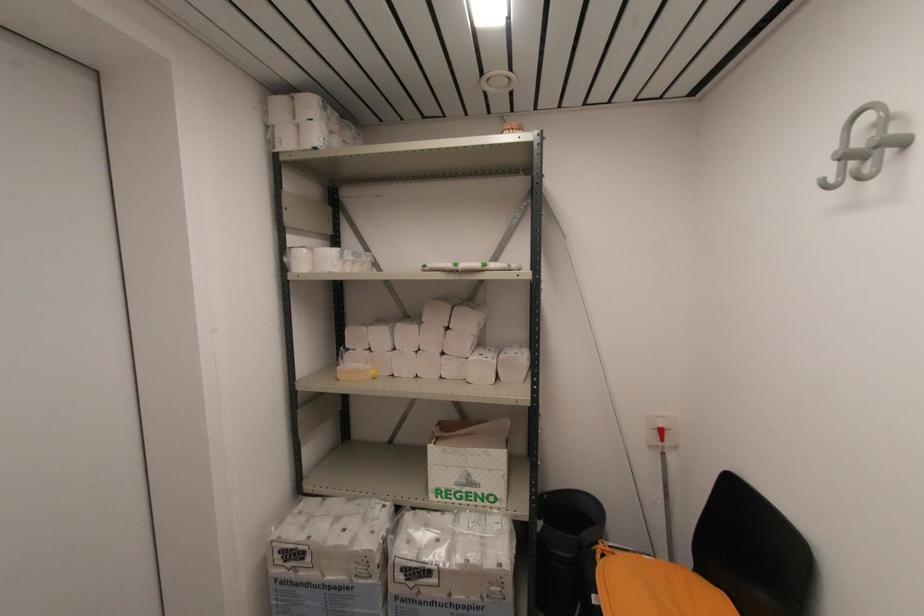
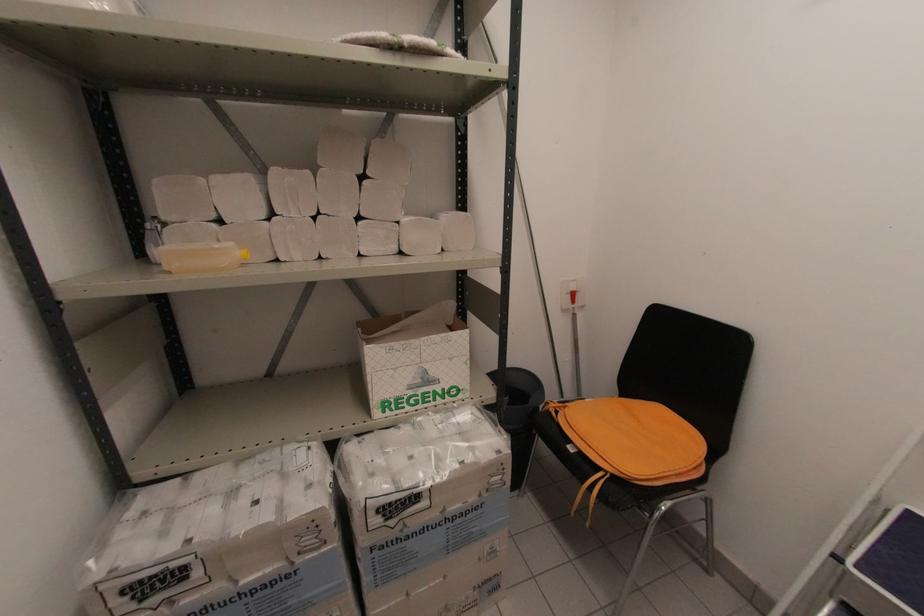
Question: The images are taken continuously from a first-person perspective. In which direction is your viewpoint rotating?

Choices:
 (A) Left
 (B) Right
 (C) Up
 (D) Down

Answer: (B)